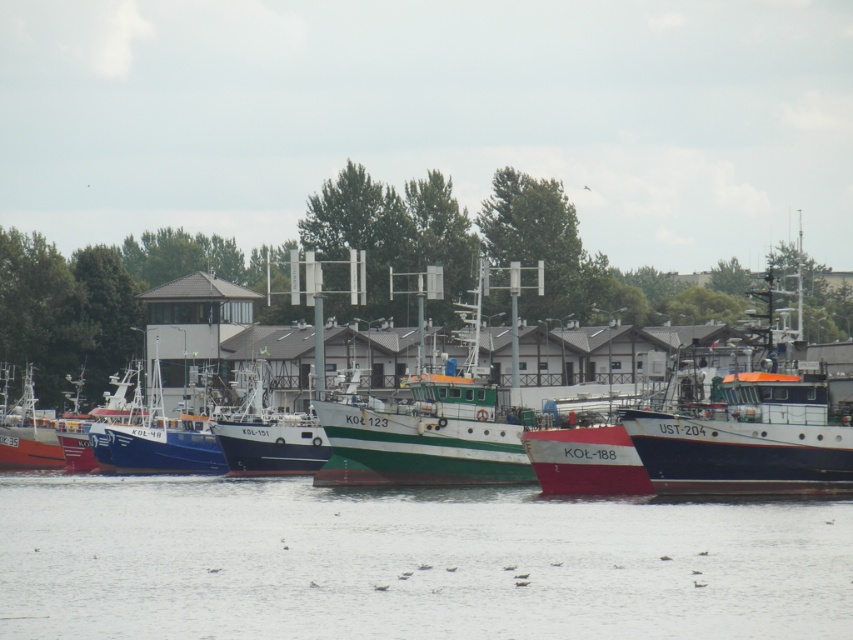
Question: Which is nearer to the green matte fishing boat at center?

Choices:
 (A) green matte boat at center
 (B) matte orange boat at left

Answer: (A)

Question: Among these points, which one is nearest to the camera?

Choices:
 (A) (369, 556)
 (B) (0, 426)
 (C) (210, 444)

Answer: (A)

Question: Does green matte boat at center have a larger size compared to green matte fishing boat at center?

Choices:
 (A) yes
 (B) no

Answer: (A)

Question: Is clear water at center smaller than blue matte boat at center?

Choices:
 (A) yes
 (B) no

Answer: (B)

Question: Among these points, which one is nearest to the camera?

Choices:
 (A) (161, 449)
 (B) (4, 461)
 (C) (291, 413)

Answer: (A)

Question: Does green matte fishing boat at center have a smaller size compared to matte orange boat at left?

Choices:
 (A) no
 (B) yes

Answer: (A)